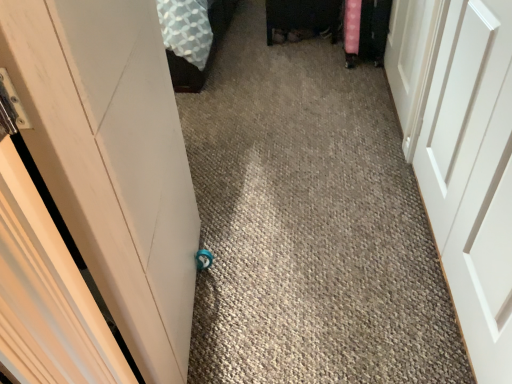
Question: Is white matte door at right, which is the 3th door from left to right, at the right side of white matte door at center, which ranks as the 2th door in left-to-right order?

Choices:
 (A) no
 (B) yes

Answer: (B)

Question: Is white matte door at right, which is the 3th door from left to right, closer to the viewer compared to white matte door at center, which ranks as the 2th door in left-to-right order?

Choices:
 (A) yes
 (B) no

Answer: (B)

Question: Can you confirm if white matte door at right, which is the 3th door from left to right, is shorter than white matte door at center, which appears as the second door when viewed from the right?

Choices:
 (A) no
 (B) yes

Answer: (B)

Question: Does white matte door at right, which is the 3th door from left to right, have a larger size compared to white matte door at center, which ranks as the 2th door in left-to-right order?

Choices:
 (A) no
 (B) yes

Answer: (B)

Question: Is white matte door at right, which is the 3th door from left to right, directly adjacent to white matte door at center, which appears as the second door when viewed from the right?

Choices:
 (A) no
 (B) yes

Answer: (A)

Question: From a real-world perspective, is white matte door at right, which is the 3th door from left to right, positioned over white matte door at center, which ranks as the 2th door in left-to-right order, based on gravity?

Choices:
 (A) no
 (B) yes

Answer: (A)

Question: Does white matte door at left, arranged as the 3th door when viewed from the right, have a greater height compared to white matte door at right, which is counted as the 1th door, starting from the right?

Choices:
 (A) yes
 (B) no

Answer: (A)

Question: Is white matte door at left, positioned as the first door in left-to-right order, not inside white matte door at right, which is the 3th door from left to right?

Choices:
 (A) yes
 (B) no

Answer: (A)

Question: Does white matte door at left, positioned as the first door in left-to-right order, have a lesser height compared to white matte door at right, which is counted as the 1th door, starting from the right?

Choices:
 (A) yes
 (B) no

Answer: (B)

Question: From a real-world perspective, is white matte door at left, positioned as the first door in left-to-right order, over white matte door at right, which is the 3th door from left to right?

Choices:
 (A) yes
 (B) no

Answer: (A)

Question: Does white matte door at left, positioned as the first door in left-to-right order, have a lesser width compared to white matte door at right, which is counted as the 1th door, starting from the right?

Choices:
 (A) yes
 (B) no

Answer: (B)

Question: Does white matte door at left, positioned as the first door in left-to-right order, have a larger size compared to white matte door at right, which is counted as the 1th door, starting from the right?

Choices:
 (A) yes
 (B) no

Answer: (A)

Question: Considering the relative sizes of white matte door at left, arranged as the 3th door when viewed from the right, and white matte door at center, which ranks as the 2th door in left-to-right order, in the image provided, is white matte door at left, arranged as the 3th door when viewed from the right, smaller than white matte door at center, which ranks as the 2th door in left-to-right order,?

Choices:
 (A) no
 (B) yes

Answer: (A)